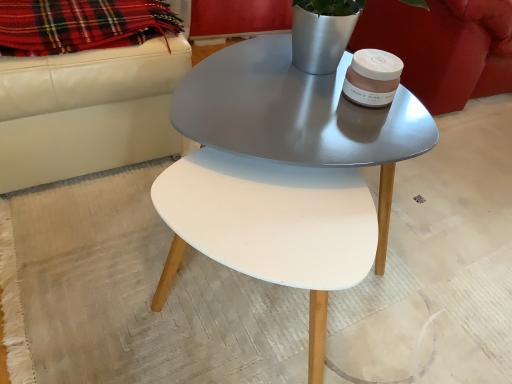
Question: Is plaid wool blanket at upper left in front of velvet red armchair at upper right?

Choices:
 (A) no
 (B) yes

Answer: (B)

Question: Considering the relative sizes of plaid wool blanket at upper left and velvet red armchair at upper right in the image provided, is plaid wool blanket at upper left shorter than velvet red armchair at upper right?

Choices:
 (A) no
 (B) yes

Answer: (B)

Question: Considering the relative sizes of plaid wool blanket at upper left and velvet red armchair at upper right in the image provided, is plaid wool blanket at upper left taller than velvet red armchair at upper right?

Choices:
 (A) yes
 (B) no

Answer: (B)

Question: Is plaid wool blanket at upper left next to velvet red armchair at upper right?

Choices:
 (A) yes
 (B) no

Answer: (B)

Question: Considering the relative sizes of plaid wool blanket at upper left and velvet red armchair at upper right in the image provided, is plaid wool blanket at upper left thinner than velvet red armchair at upper right?

Choices:
 (A) yes
 (B) no

Answer: (A)

Question: In terms of height, does plaid wool blanket at upper left look taller or shorter compared to velvet red armchair at upper right?

Choices:
 (A) short
 (B) tall

Answer: (A)

Question: Is plaid wool blanket at upper left to the left or to the right of velvet red armchair at upper right in the image?

Choices:
 (A) right
 (B) left

Answer: (B)

Question: Is plaid wool blanket at upper left bigger or smaller than velvet red armchair at upper right?

Choices:
 (A) small
 (B) big

Answer: (A)

Question: From a real-world perspective, relative to velvet red armchair at upper right, is plaid wool blanket at upper left vertically above or below?

Choices:
 (A) below
 (B) above

Answer: (B)

Question: Is velvet red armchair at upper right in front of or behind plaid wool blanket at upper left in the image?

Choices:
 (A) behind
 (B) front

Answer: (A)

Question: In terms of size, does velvet red armchair at upper right appear bigger or smaller than plaid wool blanket at upper left?

Choices:
 (A) big
 (B) small

Answer: (A)

Question: Is velvet red armchair at upper right situated inside plaid wool blanket at upper left or outside?

Choices:
 (A) outside
 (B) inside

Answer: (A)

Question: Does point (426, 77) appear closer or farther from the camera than point (143, 0)?

Choices:
 (A) farther
 (B) closer

Answer: (A)

Question: Considering the positions of point (279, 54) and point (458, 44), is point (279, 54) closer or farther from the camera than point (458, 44)?

Choices:
 (A) farther
 (B) closer

Answer: (B)

Question: Is metallic gray coffee table at center to the left or to the right of velvet red armchair at upper right in the image?

Choices:
 (A) left
 (B) right

Answer: (A)